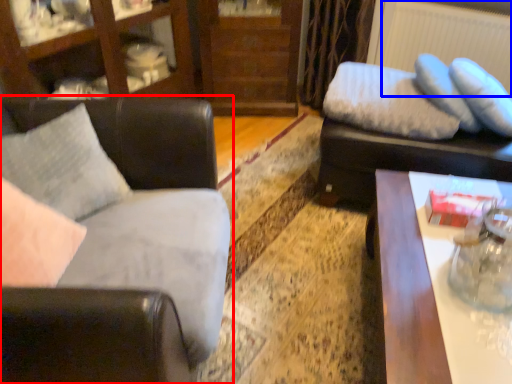
Question: Which object appears closest to the camera in this image, studio couch (highlighted by a red box) or radiator (highlighted by a blue box)?

Choices:
 (A) studio couch
 (B) radiator

Answer: (A)